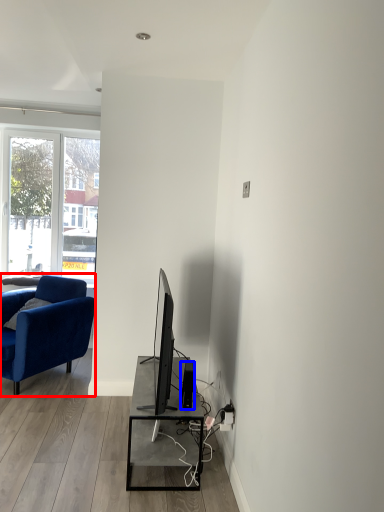
Question: Which of the following is the closest to the observer, chair (highlighted by a red box) or speaker (highlighted by a blue box)?

Choices:
 (A) chair
 (B) speaker

Answer: (B)